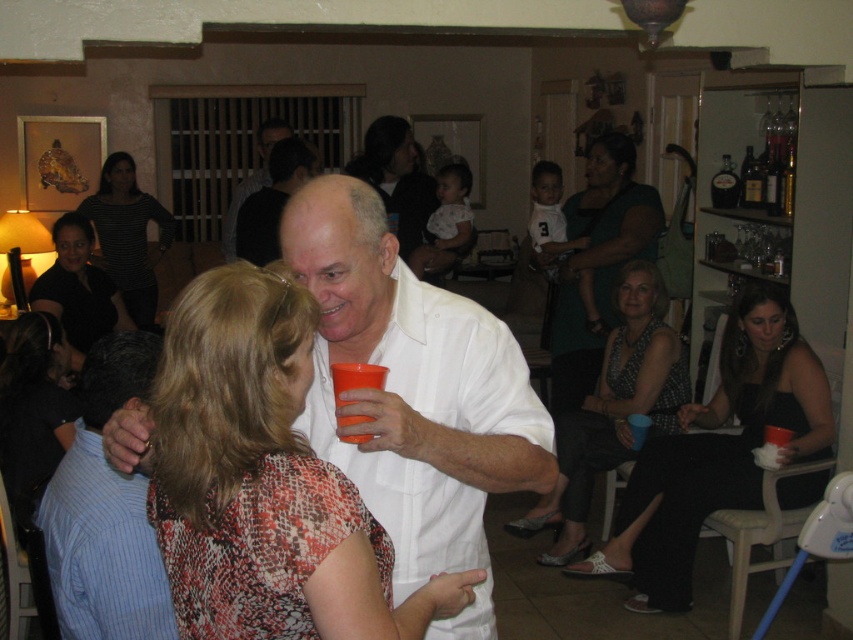
Is black satin dress at lower right to the right of matte black dress at lower right from the viewer's perspective?

Indeed, black satin dress at lower right is positioned on the right side of matte black dress at lower right.

Does black satin dress at lower right have a greater width compared to matte black dress at lower right?

Correct, the width of black satin dress at lower right exceeds that of matte black dress at lower right.

At what (x,y) coordinates should I click in order to perform the action: click on black satin dress at lower right. Please return your answer as a coordinate pair (x, y). Image resolution: width=853 pixels, height=640 pixels. Looking at the image, I should click on (717, 452).

The image size is (853, 640). What are the coordinates of `black satin dress at lower right` in the screenshot? It's located at (717, 452).

From the picture: Is white matte shirt at center below striped shirt at upper left?

Yes.

Does white matte shirt at center have a greater height compared to striped shirt at upper left?

In fact, white matte shirt at center may be shorter than striped shirt at upper left.

Between point (358, 252) and point (119, 170), which one is positioned behind?

The point (119, 170) is behind.

Where is `white matte shirt at center`? white matte shirt at center is located at coordinates (413, 394).

Is blue striped shirt at center positioned behind striped shirt at upper left?

No, blue striped shirt at center is in front of striped shirt at upper left.

Image resolution: width=853 pixels, height=640 pixels. Describe the element at coordinates (105, 512) in the screenshot. I see `blue striped shirt at center` at that location.

Find the location of a particular element. blue striped shirt at center is located at coordinates (105, 512).